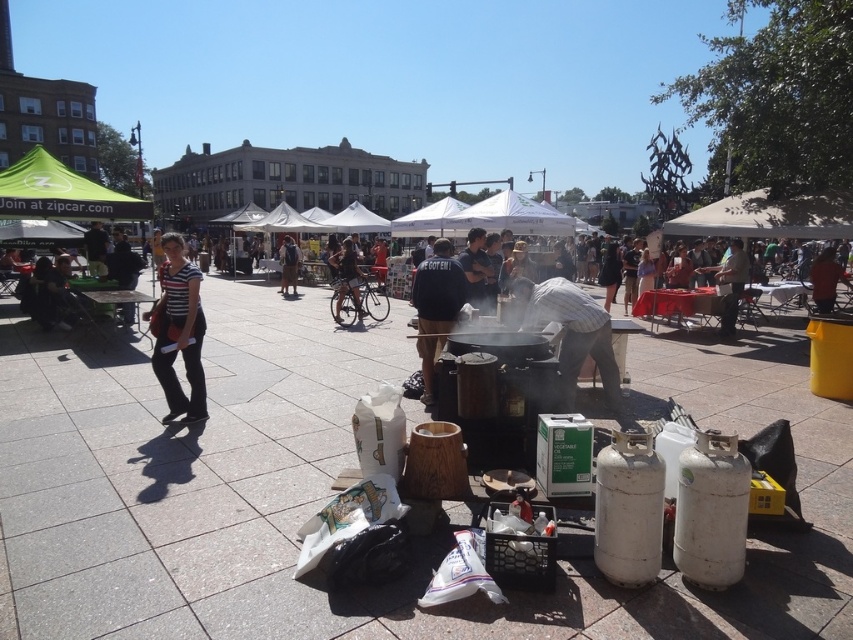
You are a person standing at the cooking station in the foreground. You want to walk to the dark blue jeans at center. Which direction should you walk to avoid passing under the green fabric canopy at upper left?

Since the green fabric canopy at upper left is closer to the viewer than the dark blue jeans at center, you should walk towards the direction away from the canopy to reach the dark blue jeans at center without passing under it.

You are a food vendor setting up a stall in the plaza. You have a large umbrella that needs to be placed under the green fabric canopy at upper left or near the dark blue jeans at center. Which location has more horizontal space for the umbrella?

The green fabric canopy at upper left has more horizontal space for the umbrella since its width surpasses that of the dark blue jeans at center.